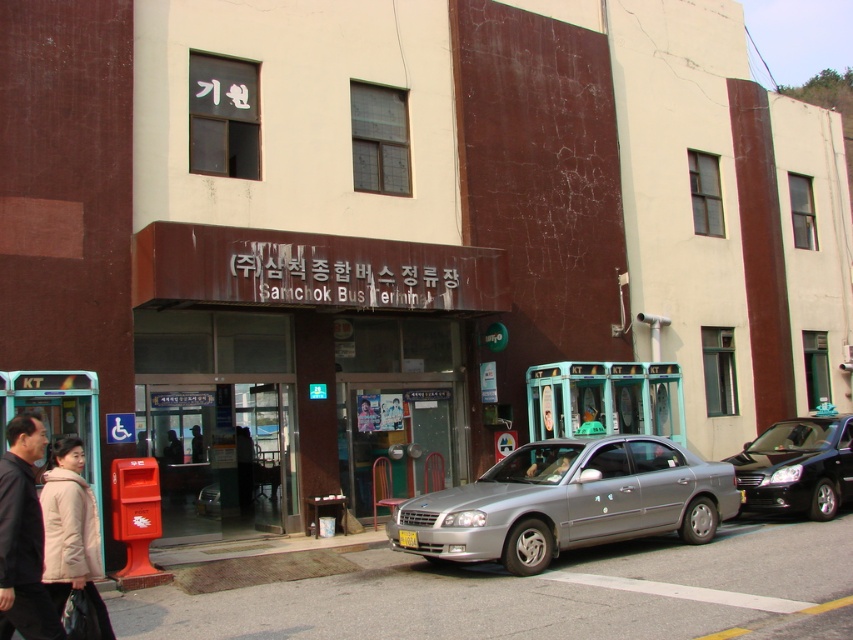
You are a pedestrian standing in front of the Samchok Bus Terminal. You see a silver metallic sedan at center and a beige quilted jacket at lower left. Which object is closer to you?

The silver metallic sedan at center is closer to you because it is further to the viewer than the beige quilted jacket at lower left.

From the picture: You are a photographer wanting to capture both the silver metallic sedan at center and the beige quilted jacket at lower left in a single frame. Given their size difference, which object should you position closer to the camera to ensure both appear balanced in the photo?

Since the silver metallic sedan at center is larger than the beige quilted jacket at lower left, you should position the beige quilted jacket at lower left closer to the camera to balance their sizes in the photo.